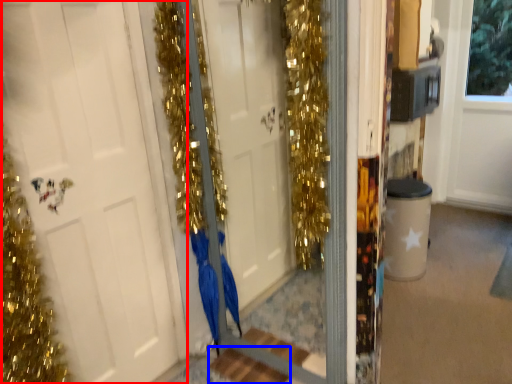
Question: Which object is further to the camera taking this photo, door (highlighted by a red box) or stair (highlighted by a blue box)?

Choices:
 (A) door
 (B) stair

Answer: (B)